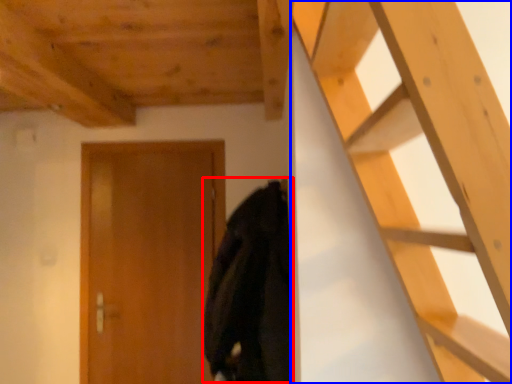
Question: Which object appears farthest to the camera in this image, cloak (highlighted by a red box) or ladder (highlighted by a blue box)?

Choices:
 (A) cloak
 (B) ladder

Answer: (A)